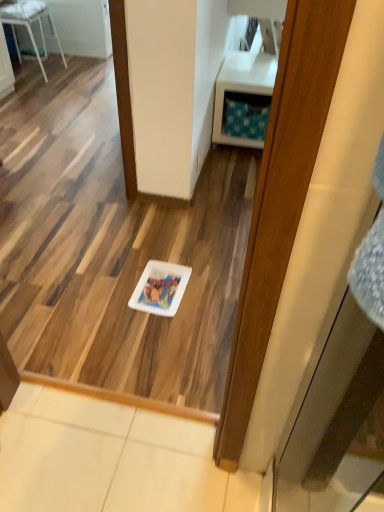
Question: Does white glossy chair at upper left lie in front of white glossy plate at center?

Choices:
 (A) yes
 (B) no

Answer: (B)

Question: Is white glossy chair at upper left positioned behind white glossy plate at center?

Choices:
 (A) no
 (B) yes

Answer: (B)

Question: Does white glossy chair at upper left have a greater width compared to white glossy plate at center?

Choices:
 (A) no
 (B) yes

Answer: (B)

Question: From the image's perspective, is white glossy chair at upper left beneath white glossy plate at center?

Choices:
 (A) yes
 (B) no

Answer: (B)

Question: Is white glossy plate at center at the back of white glossy chair at upper left?

Choices:
 (A) yes
 (B) no

Answer: (B)

Question: Is white glossy chair at upper left bigger than white glossy plate at center?

Choices:
 (A) no
 (B) yes

Answer: (B)

Question: From the image's perspective, is white plastic vanity at upper right on top of white glossy plate at center?

Choices:
 (A) no
 (B) yes

Answer: (B)

Question: Is white plastic vanity at upper right far away from white glossy plate at center?

Choices:
 (A) yes
 (B) no

Answer: (A)

Question: Is white glossy plate at center at the back of white plastic vanity at upper right?

Choices:
 (A) yes
 (B) no

Answer: (B)

Question: Is white plastic vanity at upper right to the right of white glossy plate at center from the viewer's perspective?

Choices:
 (A) no
 (B) yes

Answer: (B)

Question: Can you confirm if white plastic vanity at upper right is smaller than white glossy plate at center?

Choices:
 (A) no
 (B) yes

Answer: (A)

Question: Is the position of white plastic vanity at upper right more distant than that of white glossy plate at center?

Choices:
 (A) no
 (B) yes

Answer: (B)

Question: Is white glossy plate at center to the left of white glossy chair at upper left from the viewer's perspective?

Choices:
 (A) yes
 (B) no

Answer: (B)